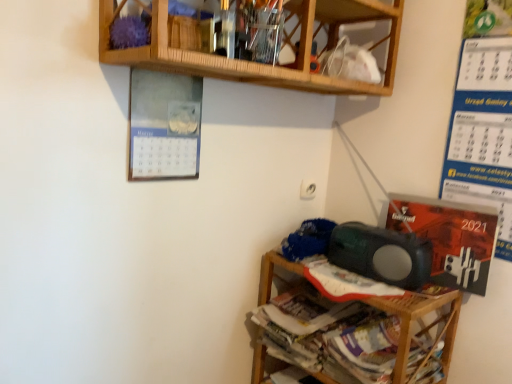
Identify the location of matte green speaker at lower right. (381, 254).

This screenshot has height=384, width=512. What do you see at coordinates (482, 134) in the screenshot?
I see `blue paper calendar at right, which is the 1th writing from top to bottom` at bounding box center [482, 134].

Image resolution: width=512 pixels, height=384 pixels. What do you see at coordinates (308, 239) in the screenshot?
I see `blue knitted fabric at lower right` at bounding box center [308, 239].

You are a GUI agent. You are given a task and a screenshot of the screen. Output one action in this format:
    pyautogui.click(x=<x>, y=<y>)
    Task: Click on the wooden shelf at lower right, which ranks as the 1th shelf in bottom-to-top order
    The image size is (512, 384).
    Given the screenshot: What is the action you would take?
    pyautogui.click(x=415, y=320)

Locate an element on the screen. This screenshot has width=512, height=384. orange glossy calendar at lower right, the first writing in the bottom-to-top sequence is located at coordinates (449, 238).

From the image's perspective, which one is positioned lower, wooden at upper center, arranged as the 1th shelf when viewed from the top, or matte green speaker at lower right?

matte green speaker at lower right is shown below in the image.

How different are the orientations of wooden at upper center, which is the second shelf in bottom-to-top order, and matte green speaker at lower right in degrees?

The angle between the facing direction of wooden at upper center, which is the second shelf in bottom-to-top order, and the facing direction of matte green speaker at lower right is 91.3 degrees.

Could matte green speaker at lower right be considered to be inside wooden at upper center, arranged as the 1th shelf when viewed from the top?

No, matte green speaker at lower right is not inside wooden at upper center, arranged as the 1th shelf when viewed from the top.

Identify the location of wide below the wooden at upper center, arranged as the 1th shelf when viewed from the top (from a real-world perspective). This screenshot has height=384, width=512. 381,254.

In the image, is wooden shelf at lower right, which ranks as the 1th shelf in bottom-to-top order, positioned in front of or behind blue paper calendar at right, which is the 1th writing from top to bottom?

Clearly, wooden shelf at lower right, which ranks as the 1th shelf in bottom-to-top order, is in front of blue paper calendar at right, which is the 1th writing from top to bottom.

Can you tell me how much wooden shelf at lower right, the second shelf from the top, and blue paper calendar at right, which is the 1th writing from top to bottom, differ in facing direction?

0.00336 degrees.

Is blue paper calendar at right, which appears as the second writing when ordered from the bottom, at the back of wooden shelf at lower right, which ranks as the 1th shelf in bottom-to-top order?

That's not correct — wooden shelf at lower right, which ranks as the 1th shelf in bottom-to-top order, is not looking away from blue paper calendar at right, which appears as the second writing when ordered from the bottom.

Considering the sizes of objects wooden shelf at lower right, the second shelf from the top, and blue paper calendar at right, which appears as the second writing when ordered from the bottom, in the image provided, who is smaller, wooden shelf at lower right, the second shelf from the top, or blue paper calendar at right, which appears as the second writing when ordered from the bottom,?

blue paper calendar at right, which appears as the second writing when ordered from the bottom, is smaller.

Is orange glossy calendar at lower right, the 2th writing in the top-to-bottom sequence, to the left or to the right of wooden shelf at lower right, the second shelf from the top, in the image?

orange glossy calendar at lower right, the 2th writing in the top-to-bottom sequence, is positioned on wooden shelf at lower right, the second shelf from the top,'s right side.

This screenshot has width=512, height=384. There is a wooden shelf at lower right, which ranks as the 1th shelf in bottom-to-top order. Find the location of `the 1st writing above it (from the image's perspective)`. the 1st writing above it (from the image's perspective) is located at coordinates (449, 238).

Is orange glossy calendar at lower right, the 2th writing in the top-to-bottom sequence, in front of wooden shelf at lower right, the second shelf from the top?

No, orange glossy calendar at lower right, the 2th writing in the top-to-bottom sequence, is further to the viewer.

Is orange glossy calendar at lower right, the first writing in the bottom-to-top sequence, next to wooden shelf at lower right, the second shelf from the top, and touching it?

No, orange glossy calendar at lower right, the first writing in the bottom-to-top sequence, is not with wooden shelf at lower right, the second shelf from the top.

Is blue knitted fabric at lower right taller or shorter than orange glossy calendar at lower right, the first writing in the bottom-to-top sequence?

Considering their sizes, blue knitted fabric at lower right has less height than orange glossy calendar at lower right, the first writing in the bottom-to-top sequence.

Measure the distance between blue knitted fabric at lower right and orange glossy calendar at lower right, the 2th writing in the top-to-bottom sequence.

blue knitted fabric at lower right is 13.78 inches from orange glossy calendar at lower right, the 2th writing in the top-to-bottom sequence.

Does point (327, 225) appear closer or farther from the camera than point (434, 238)?

Point (327, 225) appears to be farther away from the viewer than point (434, 238).

How different are the orientations of blue knitted fabric at lower right and orange glossy calendar at lower right, the 2th writing in the top-to-bottom sequence, in degrees?

6.14 degrees separate the facing orientations of blue knitted fabric at lower right and orange glossy calendar at lower right, the 2th writing in the top-to-bottom sequence.

How different are the orientations of matte green speaker at lower right and blue knitted fabric at lower right in degrees?

There is a 0.00352-degree angle between the facing directions of matte green speaker at lower right and blue knitted fabric at lower right.

Which of these two, matte green speaker at lower right or blue knitted fabric at lower right, is smaller?

blue knitted fabric at lower right is smaller.

Which object is positioned more to the left, matte green speaker at lower right or blue knitted fabric at lower right?

blue knitted fabric at lower right is more to the left.

Consider the image. Is the position of matte green speaker at lower right more distant than that of blue knitted fabric at lower right?

No, it is not.

Consider the image. What's the angular difference between matte green speaker at lower right and wooden shelf at lower right, which ranks as the 1th shelf in bottom-to-top order,'s facing directions?

matte green speaker at lower right and wooden shelf at lower right, which ranks as the 1th shelf in bottom-to-top order, are facing 2.67 degrees away from each other.

From a real-world perspective, is matte green speaker at lower right beneath wooden shelf at lower right, the second shelf from the top?

No.

Are matte green speaker at lower right and wooden shelf at lower right, which ranks as the 1th shelf in bottom-to-top order, making contact?

They are not placed beside each other.

Looking at their sizes, would you say matte green speaker at lower right is wider or thinner than wooden shelf at lower right, the second shelf from the top?

matte green speaker at lower right is thinner than wooden shelf at lower right, the second shelf from the top.

Between wooden shelf at lower right, which ranks as the 1th shelf in bottom-to-top order, and matte green speaker at lower right, which one appears on the left side from the viewer's perspective?

From the viewer's perspective, wooden shelf at lower right, which ranks as the 1th shelf in bottom-to-top order, appears more on the left side.

Where is `shelf below the matte green speaker at lower right (from a real-world perspective)`? shelf below the matte green speaker at lower right (from a real-world perspective) is located at coordinates (415, 320).

Could you tell me if wooden shelf at lower right, the second shelf from the top, is turned towards matte green speaker at lower right?

No, wooden shelf at lower right, the second shelf from the top, is not facing towards matte green speaker at lower right.

In the scene shown: Is wooden shelf at lower right, which ranks as the 1th shelf in bottom-to-top order, not near matte green speaker at lower right?

That's not correct — wooden shelf at lower right, which ranks as the 1th shelf in bottom-to-top order, is a little close to matte green speaker at lower right.

Identify the location of shelf above the matte green speaker at lower right (from the image's perspective). The height and width of the screenshot is (384, 512). (254, 63).

From the wooden shelf at lower right, the second shelf from the top, count 1st writings backward and point to it. Please provide its 2D coordinates.

[(482, 134)]

When comparing their distances from matte green speaker at lower right, does blue knitted fabric at lower right or wooden shelf at lower right, which ranks as the 1th shelf in bottom-to-top order, seem closer?

wooden shelf at lower right, which ranks as the 1th shelf in bottom-to-top order.

Based on their spatial positions, is blue paper calendar at right, which is the 1th writing from top to bottom, or matte green speaker at lower right further from blue knitted fabric at lower right?

blue paper calendar at right, which is the 1th writing from top to bottom, is further to blue knitted fabric at lower right.

Consider the image. Considering their positions, is blue paper calendar at right, which is the 1th writing from top to bottom, positioned closer to orange glossy calendar at lower right, the first writing in the bottom-to-top sequence, than wooden at upper center, which is the second shelf in bottom-to-top order?

blue paper calendar at right, which is the 1th writing from top to bottom, lies closer to orange glossy calendar at lower right, the first writing in the bottom-to-top sequence, than the other object.

Based on the photo, looking at the image, which one is located further to wooden shelf at lower right, the second shelf from the top, blue knitted fabric at lower right or blue paper calendar at right, which appears as the second writing when ordered from the bottom?

blue paper calendar at right, which appears as the second writing when ordered from the bottom, is further to wooden shelf at lower right, the second shelf from the top.

Based on their spatial positions, is blue paper calendar at right, which appears as the second writing when ordered from the bottom, or matte green speaker at lower right further from wooden shelf at lower right, the second shelf from the top?

blue paper calendar at right, which appears as the second writing when ordered from the bottom, lies further to wooden shelf at lower right, the second shelf from the top, than the other object.

Considering their positions, is blue knitted fabric at lower right positioned closer to wooden at upper center, arranged as the 1th shelf when viewed from the top, than orange glossy calendar at lower right, the first writing in the bottom-to-top sequence?

Based on the image, orange glossy calendar at lower right, the first writing in the bottom-to-top sequence, appears to be nearer to wooden at upper center, arranged as the 1th shelf when viewed from the top.

Estimate the real-world distances between objects in this image. Which object is further from blue knitted fabric at lower right, wooden at upper center, arranged as the 1th shelf when viewed from the top, or matte green speaker at lower right?

wooden at upper center, arranged as the 1th shelf when viewed from the top, lies further to blue knitted fabric at lower right than the other object.

From the image, which object appears to be farther from blue paper calendar at right, which appears as the second writing when ordered from the bottom, wooden shelf at lower right, which ranks as the 1th shelf in bottom-to-top order, or blue knitted fabric at lower right?

Among the two, blue knitted fabric at lower right is located further to blue paper calendar at right, which appears as the second writing when ordered from the bottom.

At what (x,y) coordinates should I click in order to perform the action: click on waste that lies between orange glossy calendar at lower right, the first writing in the bottom-to-top sequence, and wooden shelf at lower right, the second shelf from the top, from top to bottom. Please return your answer as a coordinate pair (x, y). Looking at the image, I should click on (308, 239).

You are a GUI agent. You are given a task and a screenshot of the screen. Output one action in this format:
    pyautogui.click(x=<x>, y=<y>)
    Task: Click on the writing between blue knitted fabric at lower right and blue paper calendar at right, which is the 1th writing from top to bottom
    The height and width of the screenshot is (384, 512).
    Given the screenshot: What is the action you would take?
    (449, 238)

What are the coordinates of `wide between orange glossy calendar at lower right, the 2th writing in the top-to-bottom sequence, and wooden shelf at lower right, which ranks as the 1th shelf in bottom-to-top order, from top to bottom` in the screenshot? It's located at (381, 254).

You are a GUI agent. You are given a task and a screenshot of the screen. Output one action in this format:
    pyautogui.click(x=<x>, y=<y>)
    Task: Click on the wide between blue knitted fabric at lower right and wooden shelf at lower right, the second shelf from the top, vertically
    
    Given the screenshot: What is the action you would take?
    381,254